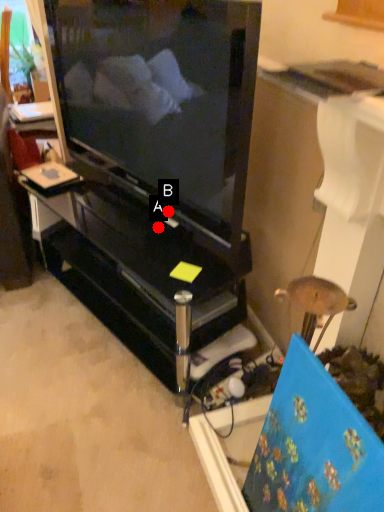
Question: Two points are circled on the image, labeled by A and B beside each circle. Which point appears farthest from the camera in this image?

Choices:
 (A) A is further
 (B) B is further

Answer: (A)